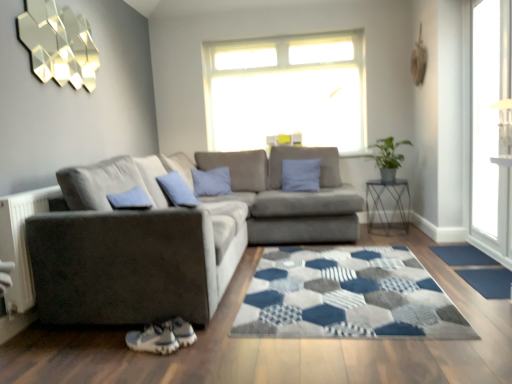
Question: Is blue fabric doormat at lower right, which is counted as the second doormat, starting from the back, directly adjacent to transparent glass door at right?

Choices:
 (A) no
 (B) yes

Answer: (A)

Question: From a real-world perspective, is blue fabric doormat at lower right, which is counted as the second doormat, starting from the back, under transparent glass door at right?

Choices:
 (A) no
 (B) yes

Answer: (B)

Question: Is blue fabric doormat at lower right, which is counted as the second doormat, starting from the back, turned away from transparent glass door at right?

Choices:
 (A) yes
 (B) no

Answer: (B)

Question: From the image's perspective, is blue fabric doormat at lower right, placed as the 1th doormat when sorted from front to back, beneath transparent glass door at right?

Choices:
 (A) yes
 (B) no

Answer: (A)

Question: Is the depth of blue fabric doormat at lower right, which is counted as the second doormat, starting from the back, greater than that of transparent glass door at right?

Choices:
 (A) no
 (B) yes

Answer: (A)

Question: In terms of height, does green leafy plant at right look taller or shorter compared to white plastic radiator at lower left?

Choices:
 (A) short
 (B) tall

Answer: (A)

Question: Which is correct: green leafy plant at right is inside white plastic radiator at lower left, or outside of it?

Choices:
 (A) outside
 (B) inside

Answer: (A)

Question: Is green leafy plant at right bigger or smaller than white plastic radiator at lower left?

Choices:
 (A) small
 (B) big

Answer: (B)

Question: Is green leafy plant at right wider or thinner than white plastic radiator at lower left?

Choices:
 (A) wide
 (B) thin

Answer: (A)

Question: Considering the positions of point (34, 193) and point (484, 294), is point (34, 193) closer or farther from the camera than point (484, 294)?

Choices:
 (A) closer
 (B) farther

Answer: (A)

Question: In terms of width, does white plastic radiator at lower left look wider or thinner when compared to blue fabric doormat at lower right, which is counted as the second doormat, starting from the back?

Choices:
 (A) thin
 (B) wide

Answer: (A)

Question: Based on their sizes in the image, would you say white plastic radiator at lower left is bigger or smaller than blue fabric doormat at lower right, placed as the 1th doormat when sorted from front to back?

Choices:
 (A) small
 (B) big

Answer: (B)

Question: From a real-world perspective, relative to blue fabric doormat at lower right, which is counted as the second doormat, starting from the back, is white plastic radiator at lower left vertically above or below?

Choices:
 (A) above
 (B) below

Answer: (A)

Question: In terms of height, does metallic wire table at right look taller or shorter compared to green leafy plant at right?

Choices:
 (A) tall
 (B) short

Answer: (A)

Question: From the image's perspective, is metallic wire table at right above or below green leafy plant at right?

Choices:
 (A) below
 (B) above

Answer: (A)